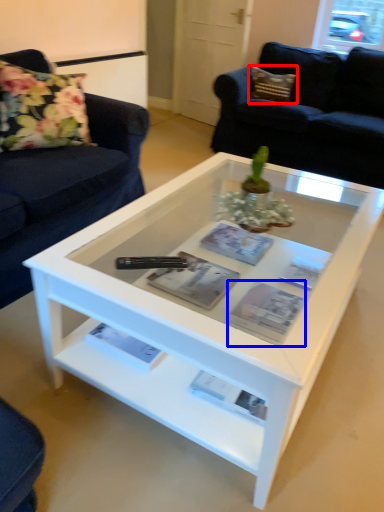
Question: Among these objects, which one is nearest to the camera, pillow (highlighted by a red box) or magazine (highlighted by a blue box)?

Choices:
 (A) pillow
 (B) magazine

Answer: (B)